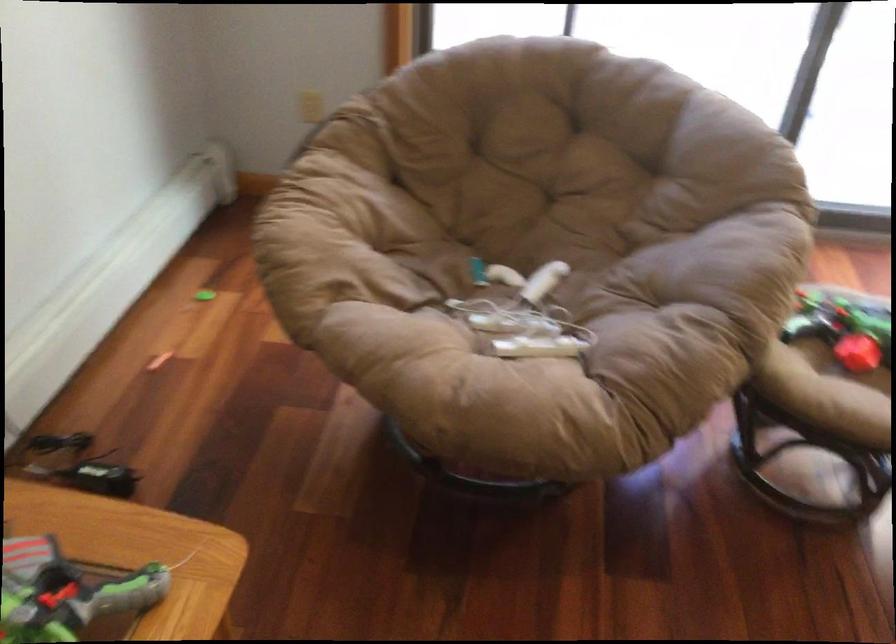
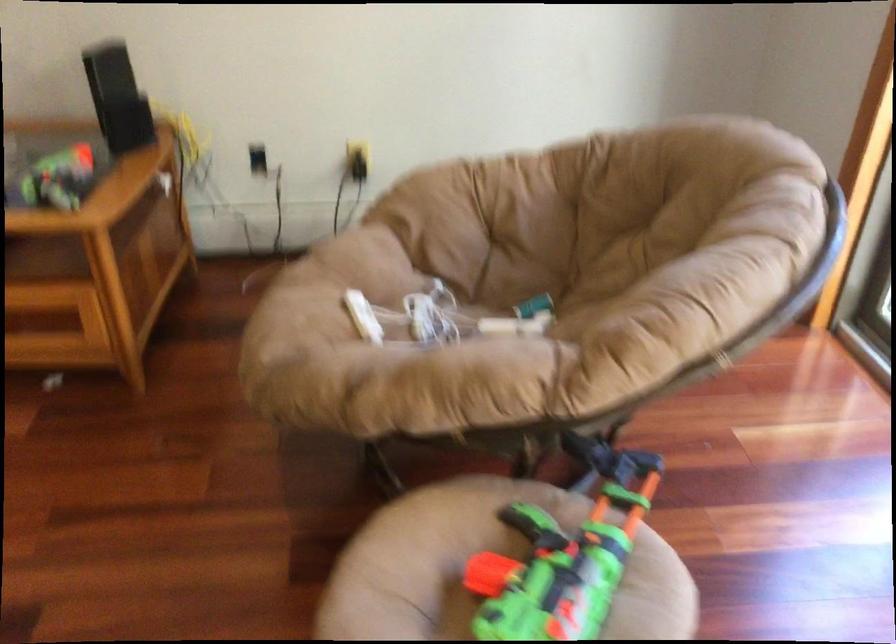
The point at [553,276] is marked in the first image. Where is the corresponding point in the second image?

(512, 326)